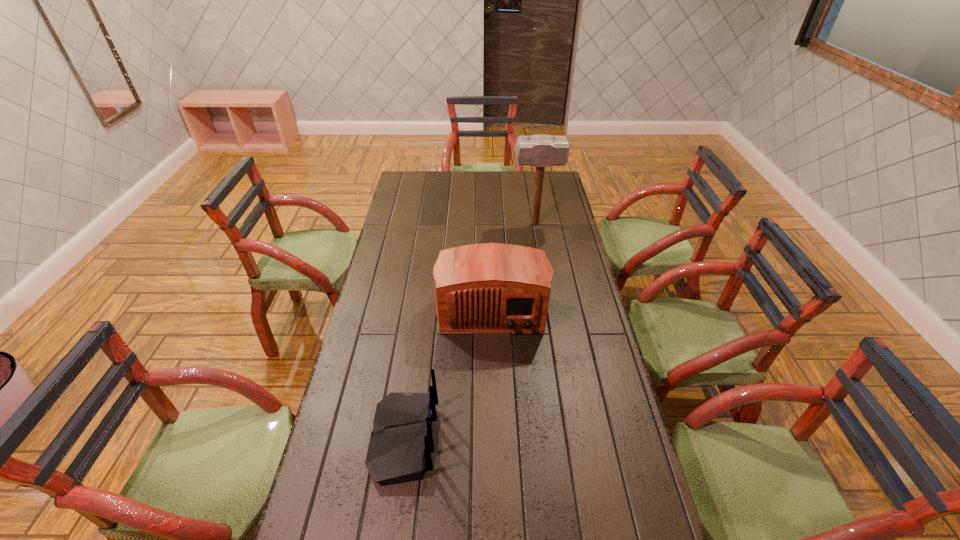
Locate an element on the screen. The width and height of the screenshot is (960, 540). free space located on the back of the nearest object is located at coordinates (538, 439).

Where is `object that is positioned at the left edge`? object that is positioned at the left edge is located at coordinates pos(399,450).

Locate an element on the screen. The height and width of the screenshot is (540, 960). object that is positioned at the right edge is located at coordinates (541, 150).

The height and width of the screenshot is (540, 960). Identify the location of vacant space at the left edge. (361, 432).

The image size is (960, 540). I want to click on vacant space at the right edge of the desktop, so click(x=583, y=289).

Where is `vacant area at the far right corner`? vacant area at the far right corner is located at coordinates click(x=555, y=189).

I want to click on free space that is in between the shortest object and the radio receiver, so click(447, 372).

Where is `vacant space in between the second tallest object and the shortest object`? Image resolution: width=960 pixels, height=540 pixels. vacant space in between the second tallest object and the shortest object is located at coordinates (447, 372).

Locate which object ranks in proximity to the tallest object. Please provide its 2D coordinates. Your answer should be formatted as a tuple, i.e. [(x, y)], where the tuple contains the x and y coordinates of a point satisfying the conditions above.

[(491, 287)]

Find the location of a particular element. object that is the closest to the nearest object is located at coordinates (491, 287).